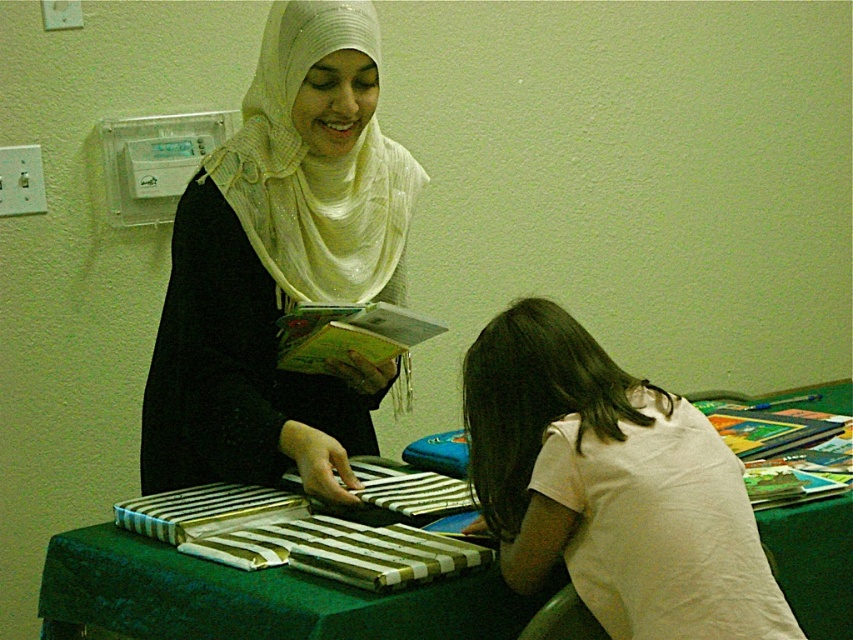
You are a photographer setting up for a portrait. You need to ensure the matte white hijab at upper center and the green fabric table at center are both in frame. Based on their positions, which object is closer to the right edge of the photo?

The matte white hijab at upper center is positioned on the right side of green fabric table at center, so it is closer to the right edge of the photo.

You are an interior designer planning to place a decorative item between the matte white hijab at upper center and the white sheer hijab at upper center. Which hijab should you place the item closer to if you want it to be centered between them?

The matte white hijab at upper center is wider than the white sheer hijab at upper center. To center the decorative item between them, place it closer to the white sheer hijab at upper center since the wider hijab would require more space, balancing the distance from the center point.

You are an interior designer observing the two hijabs on the table. Which one is positioned lower on the table, the matte white hijab at upper center or the white sheer hijab at upper center?

The matte white hijab at upper center is positioned below the white sheer hijab at upper center, so it is lower on the table.